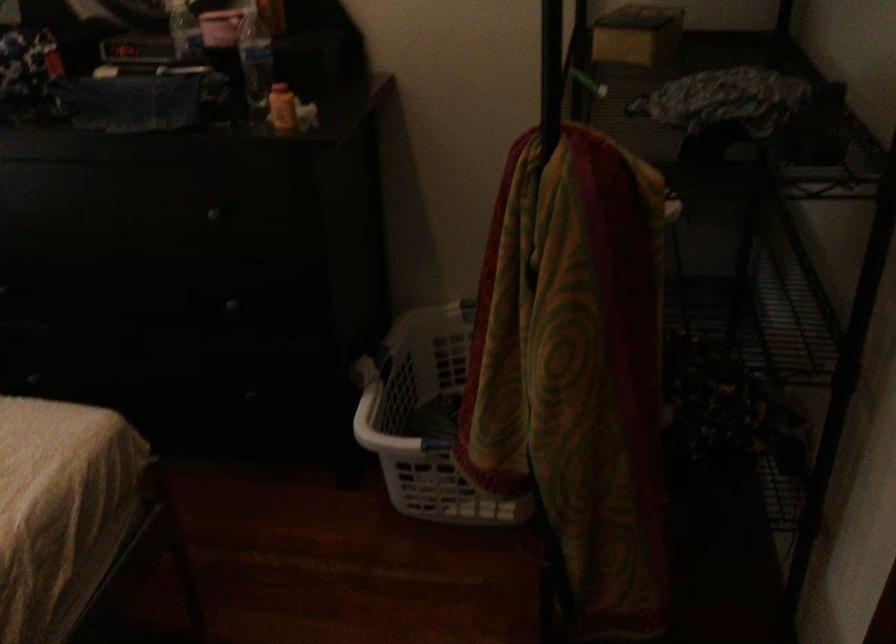
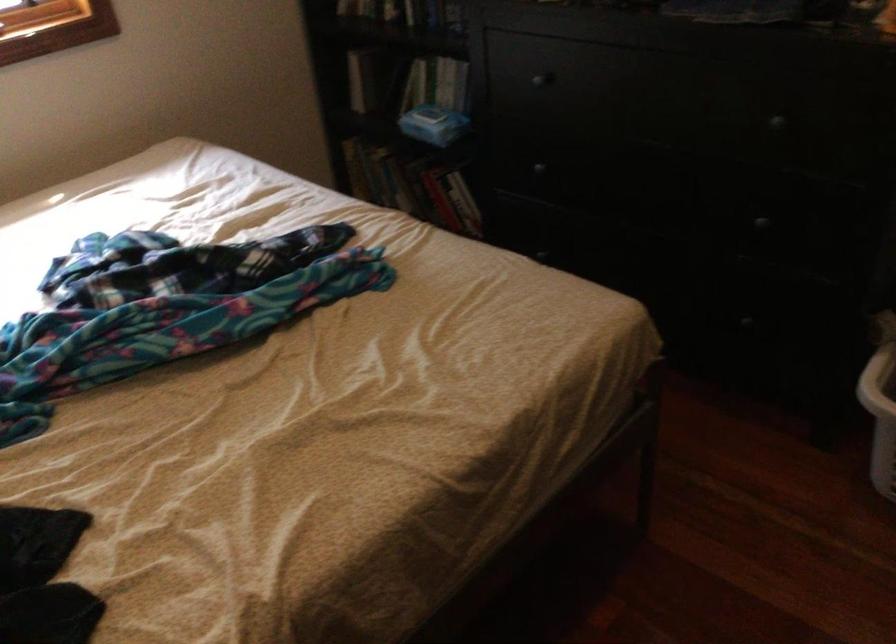
In the second image, find the point that corresponds to point (225, 303) in the first image.

(761, 223)